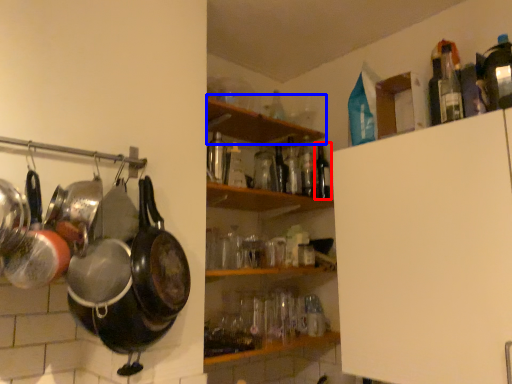
Question: Which object appears closest to the camera in this image, bottle (highlighted by a red box) or shelf (highlighted by a blue box)?

Choices:
 (A) bottle
 (B) shelf

Answer: (B)